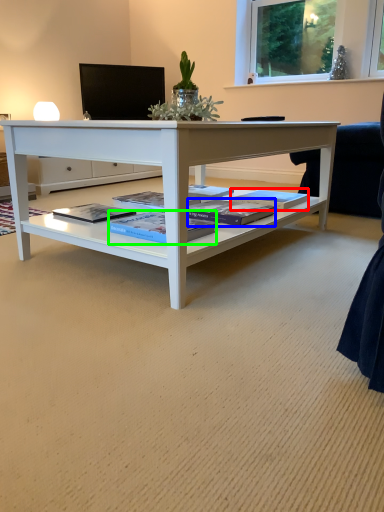
Question: Based on their relative distances, which object is farther from magazine (highlighted by a red box)? Choose from magazine (highlighted by a blue box) and magazine (highlighted by a green box).

Choices:
 (A) magazine
 (B) magazine

Answer: (B)